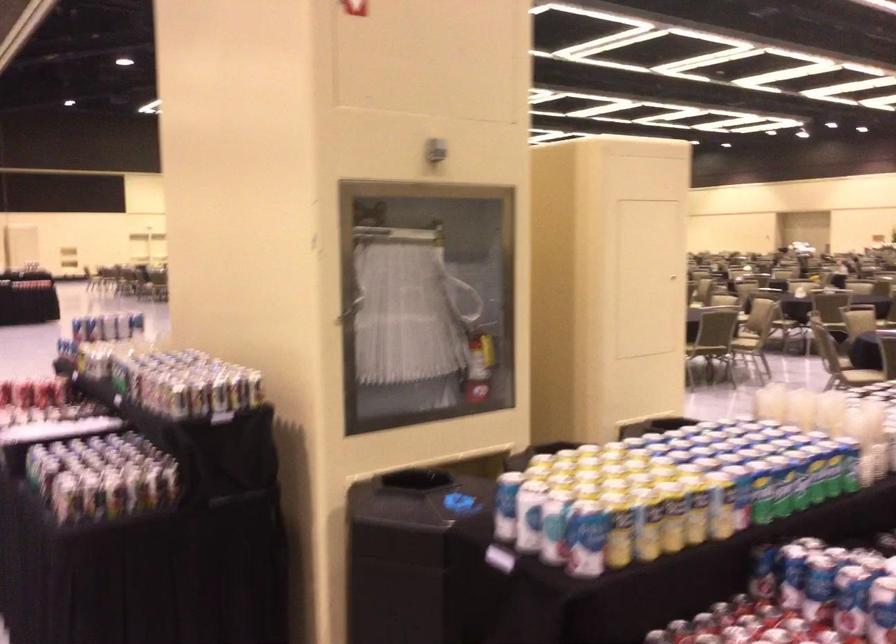
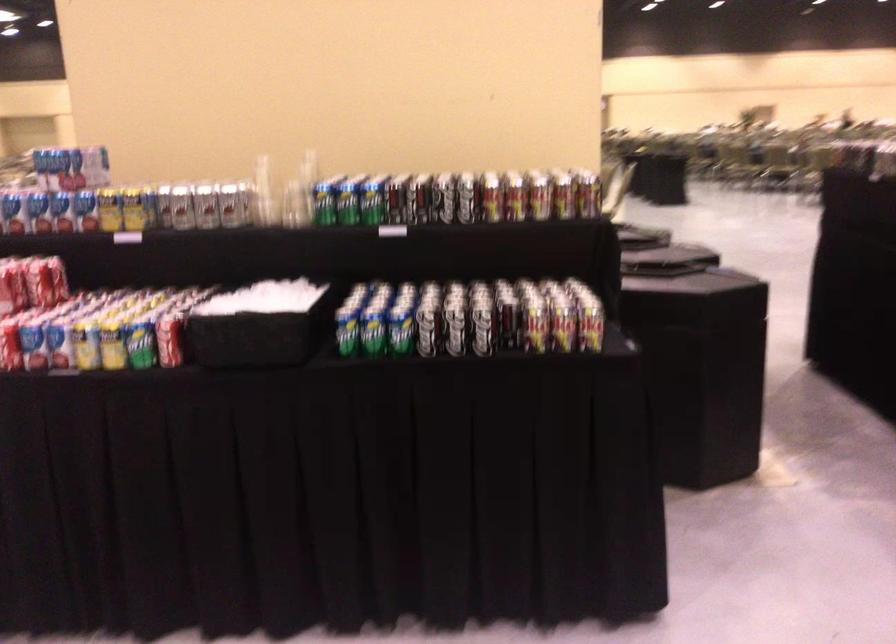
The point at (95, 337) is marked in the first image. Where is the corresponding point in the second image?

(108, 210)